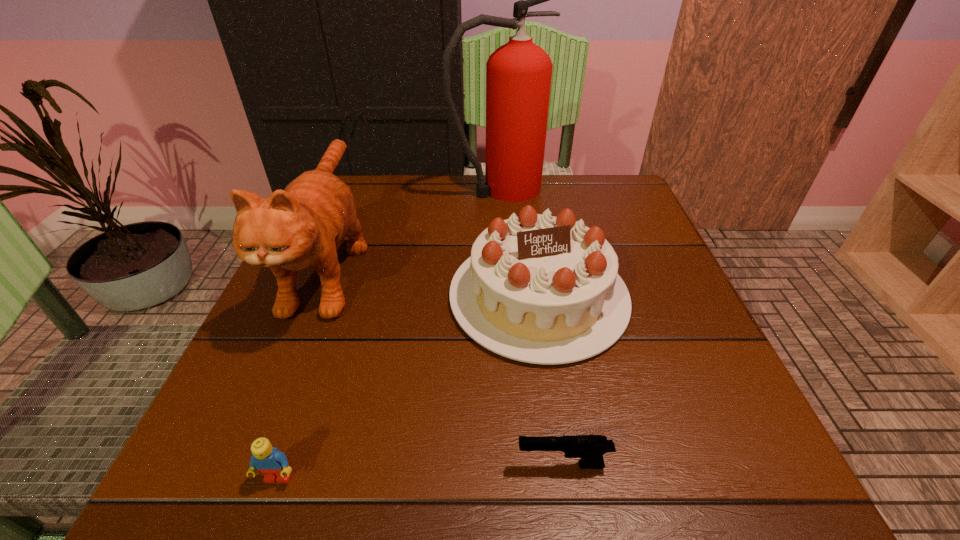
Locate an element on the screen. Image resolution: width=960 pixels, height=540 pixels. free space located 0.320m on the front-facing side of the shortest object is located at coordinates (279, 465).

The width and height of the screenshot is (960, 540). I want to click on free space located 0.070m on the front-facing side of the shortest object, so click(x=465, y=465).

Find the location of a particular element. The height and width of the screenshot is (540, 960). fire extinguisher located in the far edge section of the desktop is located at coordinates (518, 74).

At what (x,y) coordinates should I click in order to perform the action: click on cat that is positioned at the far edge. Please return your answer as a coordinate pair (x, y). The width and height of the screenshot is (960, 540). Looking at the image, I should click on (302, 226).

The height and width of the screenshot is (540, 960). In order to click on Lego located in the near edge section of the desktop in this screenshot , I will do (x=273, y=464).

Image resolution: width=960 pixels, height=540 pixels. In order to click on pistol located at the near edge in this screenshot , I will do `click(590, 448)`.

You are a GUI agent. You are given a task and a screenshot of the screen. Output one action in this format:
    pyautogui.click(x=<x>, y=<y>)
    Task: Click on the cat at the left edge
    This screenshot has width=960, height=540.
    Given the screenshot: What is the action you would take?
    pyautogui.click(x=302, y=226)

You are a GUI agent. You are given a task and a screenshot of the screen. Output one action in this format:
    pyautogui.click(x=<x>, y=<y>)
    Task: Click on the Lego at the left edge
    
    Given the screenshot: What is the action you would take?
    pyautogui.click(x=273, y=464)

I want to click on object present at the right edge, so click(539, 289).

You are a GUI agent. You are given a task and a screenshot of the screen. Output one action in this format:
    pyautogui.click(x=<x>, y=<y>)
    Task: Click on the object located in the far left corner section of the desktop
    
    Given the screenshot: What is the action you would take?
    pyautogui.click(x=302, y=226)